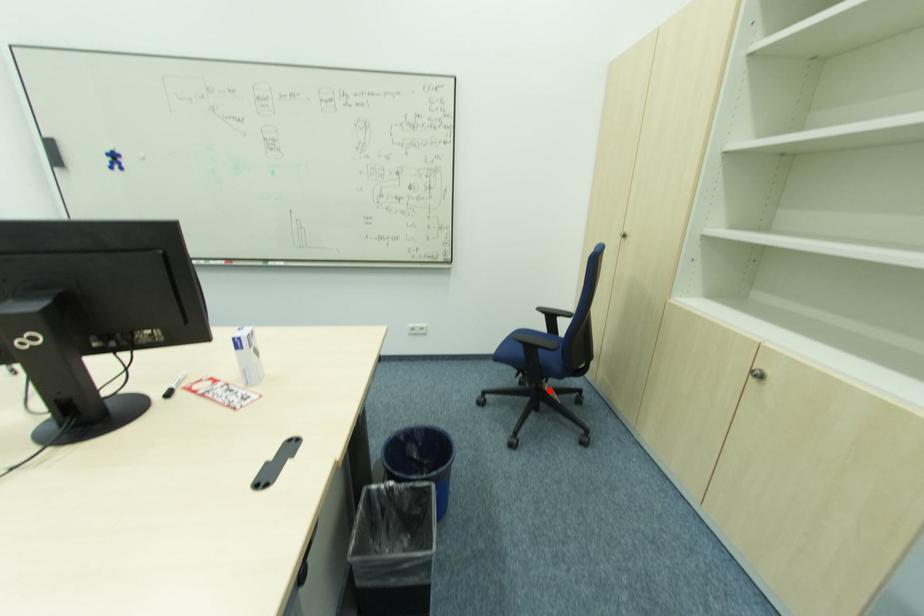
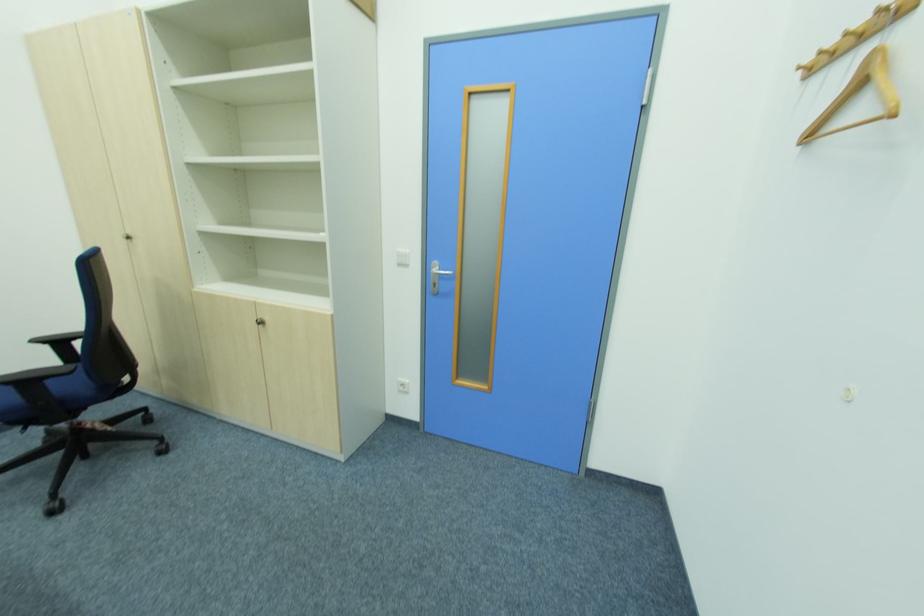
Question: I am providing you with two images of the same scene from different viewpoints. In image1, a red point is highlighted. Considering the same 3D point in image2, which of the following is correct?

Choices:
 (A) It is closer
 (B) It is farther

Answer: (A)